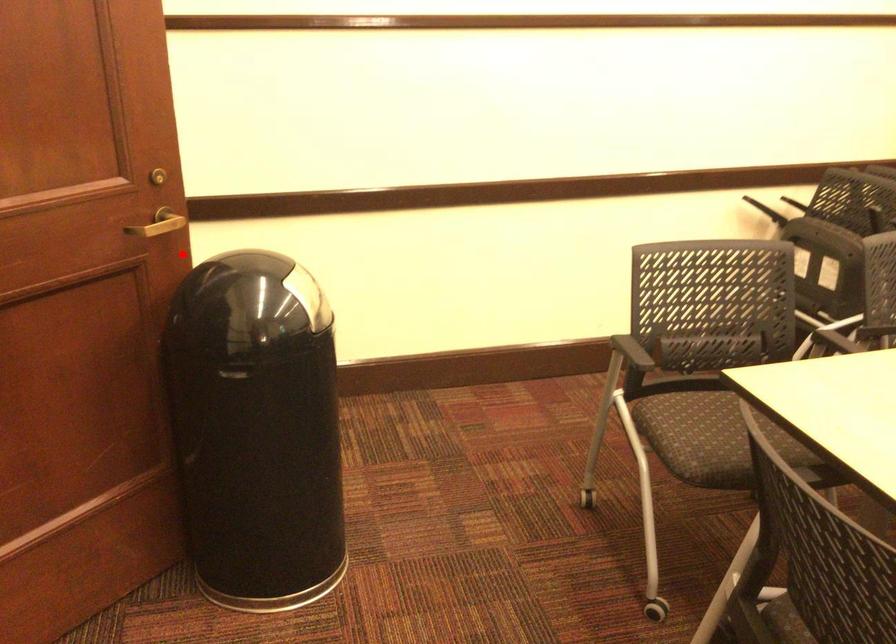
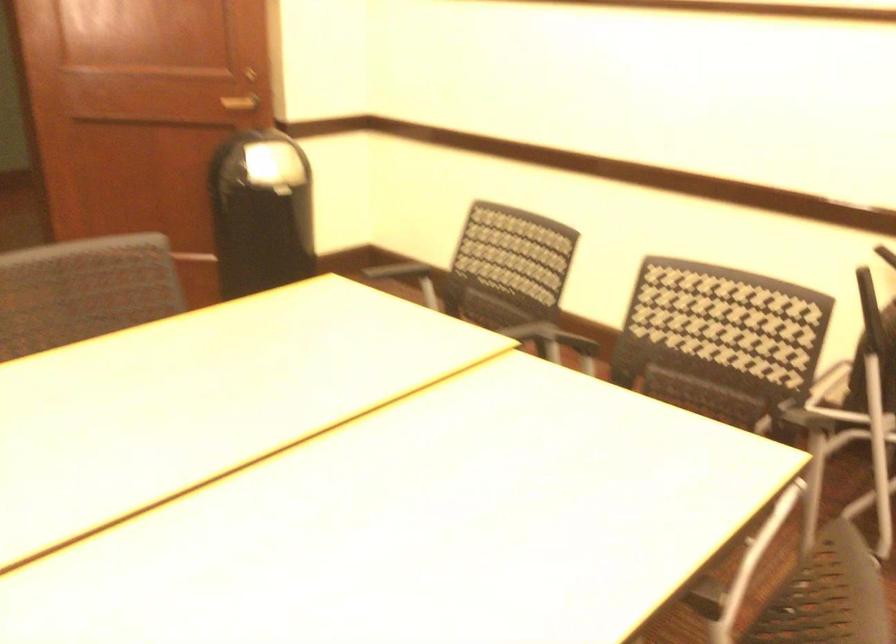
Locate, in the second image, the point that corresponds to the highlighted location in the first image.

(240, 102)